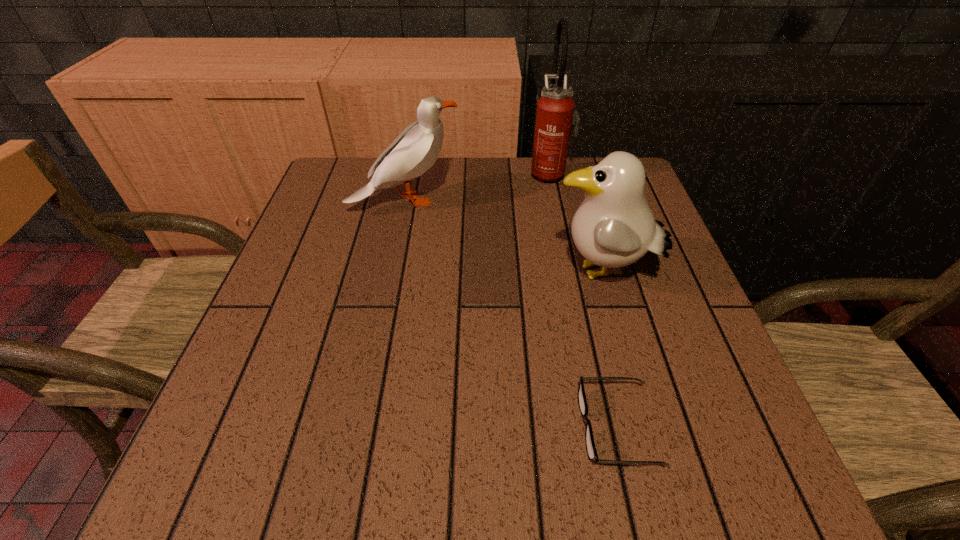
You are a GUI agent. You are given a task and a screenshot of the screen. Output one action in this format:
    pyautogui.click(x=<x>, y=<y>)
    Task: Click on the tallest object
    
    Given the screenshot: What is the action you would take?
    555,115

Where is `the right gull`? Image resolution: width=960 pixels, height=540 pixels. the right gull is located at coordinates (613, 227).

Where is `the nearer gull`? Image resolution: width=960 pixels, height=540 pixels. the nearer gull is located at coordinates (613, 227).

The height and width of the screenshot is (540, 960). Identify the location of the farther gull. (415, 150).

Where is `the left gull`? Image resolution: width=960 pixels, height=540 pixels. the left gull is located at coordinates [415, 150].

At what (x,y) coordinates should I click in order to perform the action: click on the nearest object. Please return your answer as a coordinate pair (x, y). The image size is (960, 540). Looking at the image, I should click on (592, 454).

Locate an element on the screen. This screenshot has width=960, height=540. spectacles is located at coordinates (x=592, y=454).

Where is `vacant point located at the nozzle of the fire extinguisher`? The image size is (960, 540). vacant point located at the nozzle of the fire extinguisher is located at coordinates (397, 173).

Identify the location of free space located at the nozzle of the fire extinguisher. This screenshot has width=960, height=540. (401, 173).

The width and height of the screenshot is (960, 540). In order to click on vacant area located 0.340m at the nozzle of the fire extinguisher in this screenshot , I will do `click(401, 173)`.